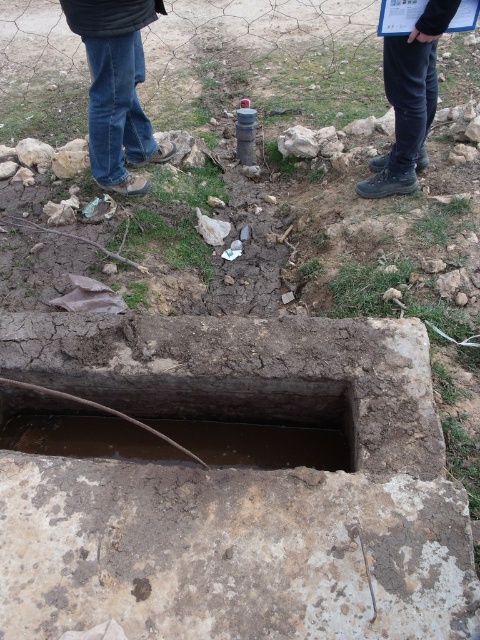
You are a construction worker who needs to step over the brown concrete hole at center while wearing the jeans at center. Can you safely do so without bending down?

The brown concrete hole at center has a lesser height compared to jeans at center, so yes, you can safely step over the brown concrete hole at center without bending down since its height is lower than the jeans at center.

You are standing at the point labeled point (62, 428) and want to walk to the point labeled point (428, 74). Which direction should you face to move towards your destination?

You should face towards the upper left direction to move from point (62, 428) to point (428, 74) because point (62, 428) is closer to the viewer than point (428, 74).